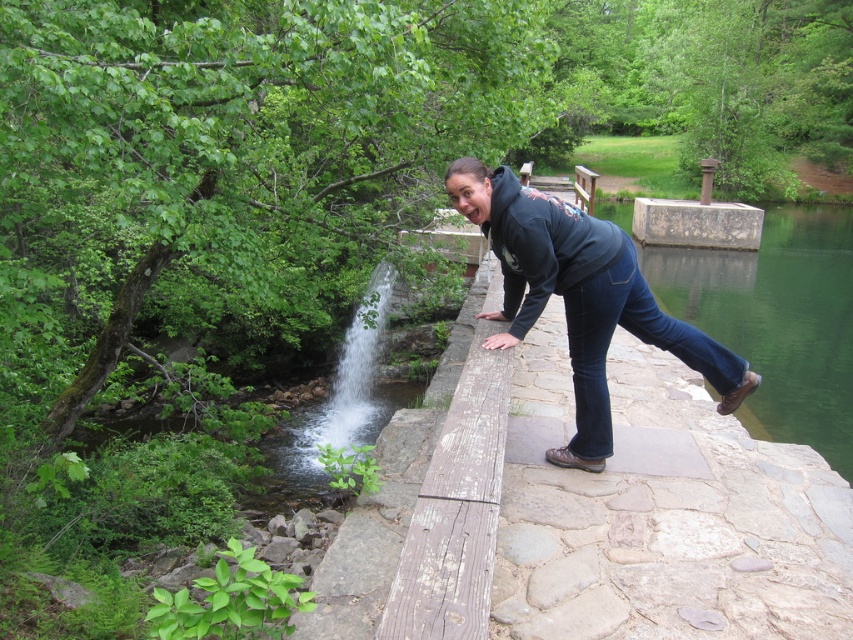
Between dark blue hoodie at center and clear water at center, which one is positioned lower?

dark blue hoodie at center is lower down.

Which is in front, point (677, 333) or point (367, 348)?

Positioned in front is point (677, 333).

Does point (611, 308) come behind point (317, 468)?

No, (611, 308) is closer to viewer.

In order to click on dark blue hoodie at center in this screenshot , I will do `click(579, 298)`.